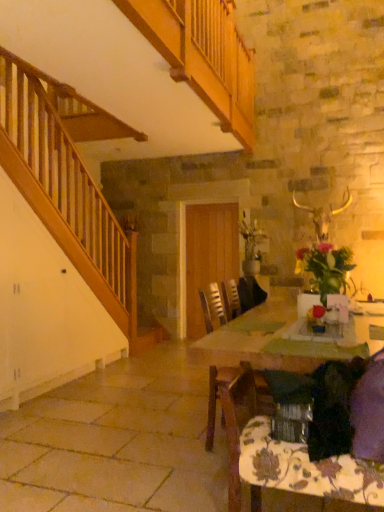
Question: In the image, is wooden chair at center on the left side or the right side of floral-patterned fabric at lower right?

Choices:
 (A) right
 (B) left

Answer: (B)

Question: Considering the positions of wooden chair at center and floral-patterned fabric at lower right in the image, is wooden chair at center taller or shorter than floral-patterned fabric at lower right?

Choices:
 (A) short
 (B) tall

Answer: (B)

Question: Which is farther from the wooden table at center?

Choices:
 (A) floral-patterned fabric at lower right
 (B) wooden chair at center

Answer: (A)

Question: Estimate the real-world distances between objects in this image. Which object is closer to the wooden chair at center?

Choices:
 (A) floral-patterned fabric at lower right
 (B) wooden table at center

Answer: (B)